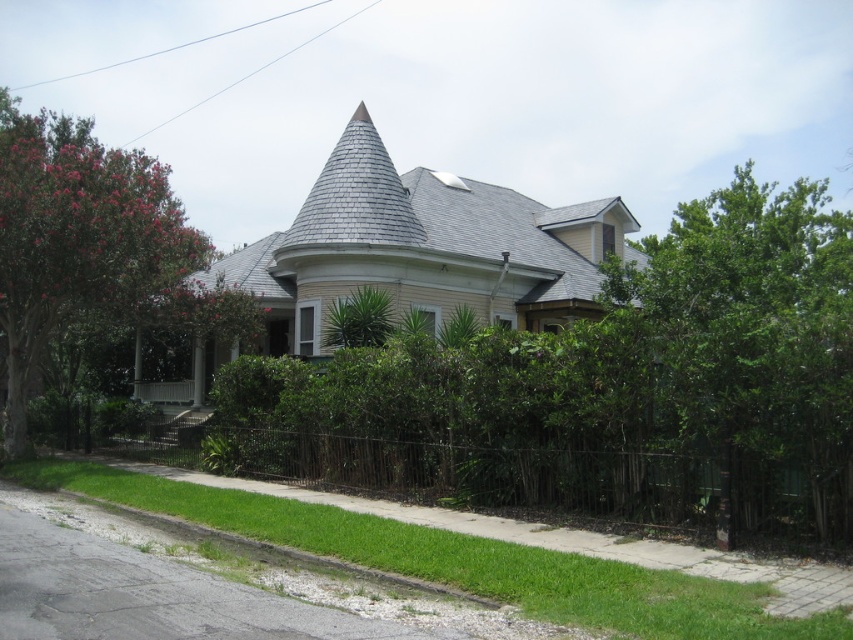
Question: Considering the real-world distances, which object is closest to the black wrought iron fence at lower center?

Choices:
 (A) green leafy tree at right
 (B) green leafy bush at center
 (C) green leafy tree at left

Answer: (C)

Question: Which of the following is the farthest from the observer?

Choices:
 (A) green leafy bush at center
 (B) black wrought iron fence at lower center
 (C) green leafy tree at right
 (D) green leafy tree at left

Answer: (D)

Question: Can you confirm if green leafy bush at center is wider than green leafy tree at right?

Choices:
 (A) yes
 (B) no

Answer: (A)

Question: Among these points, which one is nearest to the camera?

Choices:
 (A) (28, 212)
 (B) (227, 474)

Answer: (A)

Question: Can you confirm if green leafy tree at right is wider than black wrought iron fence at lower center?

Choices:
 (A) no
 (B) yes

Answer: (B)

Question: Is green leafy tree at right to the left of green leafy tree at left from the viewer's perspective?

Choices:
 (A) yes
 (B) no

Answer: (B)